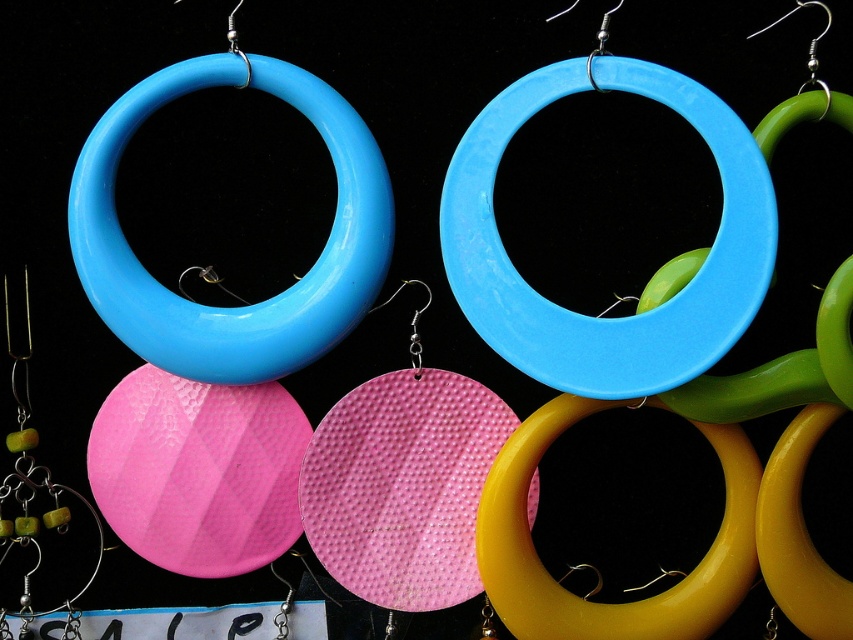
In the scene shown: You are a customer at a jewelry store looking at the earrings. You want to know which hoop is wider between the matte plastic hoop at upper left and the yellow glossy hoop at center. Can you tell me which one?

The matte plastic hoop at upper left is wider than the yellow glossy hoop at center.

Where is the glossy plastic hoop at center located in the image?

The glossy plastic hoop at center is located at point (590, 316).

You are a customer at a jewelry store looking to buy earrings. You see the glossy plastic hoop at center and the matte plastic hoop at upper left. Which one is wider?

The glossy plastic hoop at center is wider than the matte plastic hoop at upper left.